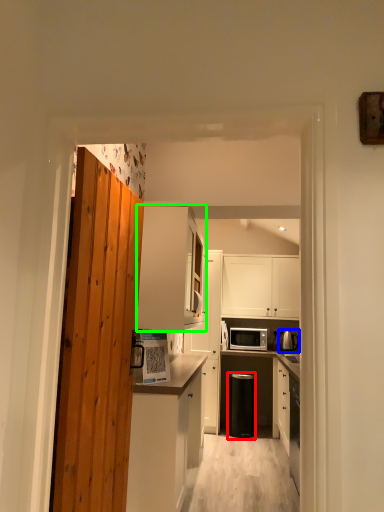
Question: Which is nearer to the appliance (highlighted by a red box)? appliance (highlighted by a blue box) or cabinetry (highlighted by a green box).

Choices:
 (A) appliance
 (B) cabinetry

Answer: (A)